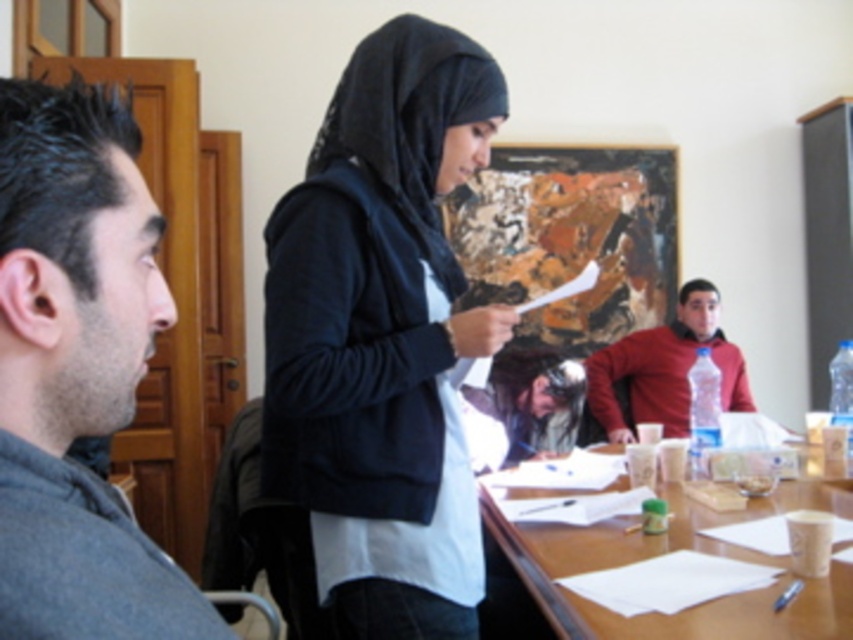
Is point (683, 538) positioned before point (627, 333)?

That is True.

Which of these two, wooden table at center or matte plastic water bottle at right, stands taller?

matte plastic water bottle at right is taller.

Between point (772, 499) and point (665, 348), which one is positioned behind?

The point (665, 348) is more distant.

Where is `wooden table at center`? This screenshot has width=853, height=640. wooden table at center is located at coordinates (662, 554).

What do you see at coordinates (381, 337) in the screenshot? The width and height of the screenshot is (853, 640). I see `black matte hijab at center` at bounding box center [381, 337].

Does black matte hijab at center have a greater width compared to matte plastic water bottle at right?

In fact, black matte hijab at center might be narrower than matte plastic water bottle at right.

Where is `black matte hijab at center`? black matte hijab at center is located at coordinates pyautogui.click(x=381, y=337).

Based on the photo, which is below, dark gray shirt at left or wooden table at center?

wooden table at center is lower down.

How far apart are dark gray shirt at left and wooden table at center?

dark gray shirt at left and wooden table at center are 37.74 inches apart from each other.

Is point (13, 102) behind point (722, 609)?

No, it is in front of (722, 609).

Locate an element on the screen. dark gray shirt at left is located at coordinates (77, 369).